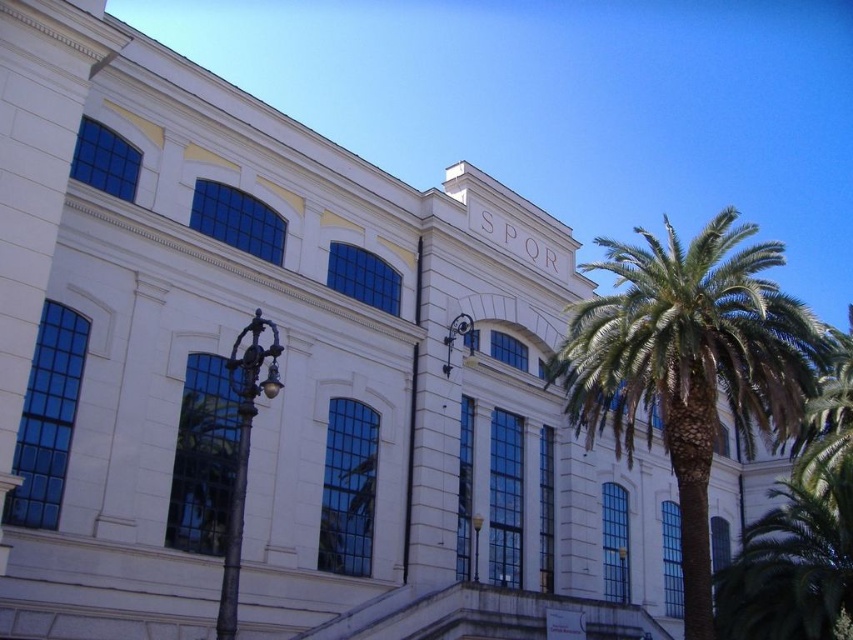
Can you confirm if green leafy palm tree at right is positioned to the left of white glossy clock at upper center?

Incorrect, green leafy palm tree at right is not on the left side of white glossy clock at upper center.

Between green leafy palm tree at right and white glossy clock at upper center, which one appears on the right side from the viewer's perspective?

green leafy palm tree at right is more to the right.

Locate an element on the screen. The height and width of the screenshot is (640, 853). green leafy palm tree at right is located at coordinates (689, 365).